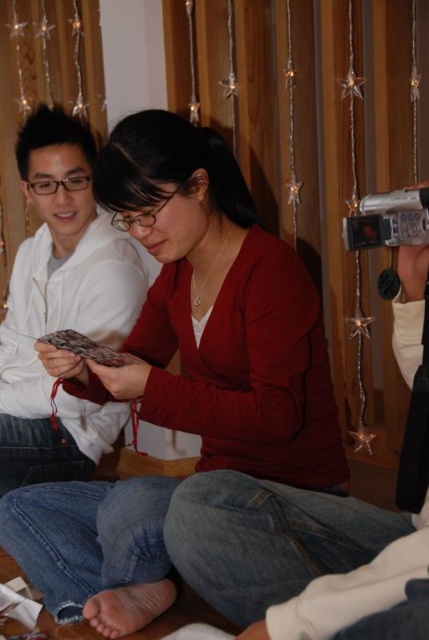
Question: Can you confirm if white matte sweater at left is bigger than silver metallic video camera at upper right?

Choices:
 (A) no
 (B) yes

Answer: (B)

Question: Can you confirm if matte red sweater at center is positioned above white matte sweater at left?

Choices:
 (A) no
 (B) yes

Answer: (A)

Question: From the image, what is the correct spatial relationship of white matte sweater at left in relation to silver metallic video camera at upper right?

Choices:
 (A) below
 (B) above

Answer: (A)

Question: Which object is the closest to the silver metallic video camera at upper right?

Choices:
 (A) white matte sweater at left
 (B) matte red sweater at center

Answer: (B)

Question: Which point is closer to the camera?

Choices:
 (A) (404, 196)
 (B) (69, 198)
 (C) (151, 522)

Answer: (A)

Question: Which object is closer to the camera taking this photo?

Choices:
 (A) matte red sweater at center
 (B) white matte sweater at left
 (C) silver metallic video camera at upper right

Answer: (C)